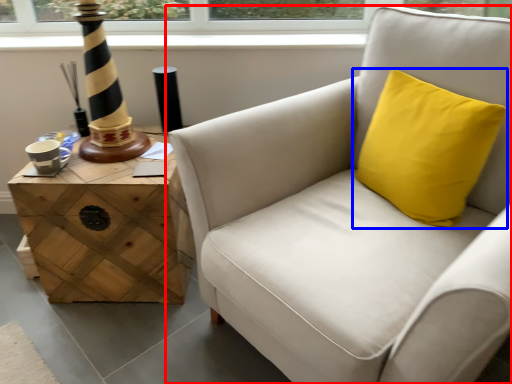
Question: Which object is closer to the camera taking this photo, chair (highlighted by a red box) or pillow (highlighted by a blue box)?

Choices:
 (A) chair
 (B) pillow

Answer: (A)